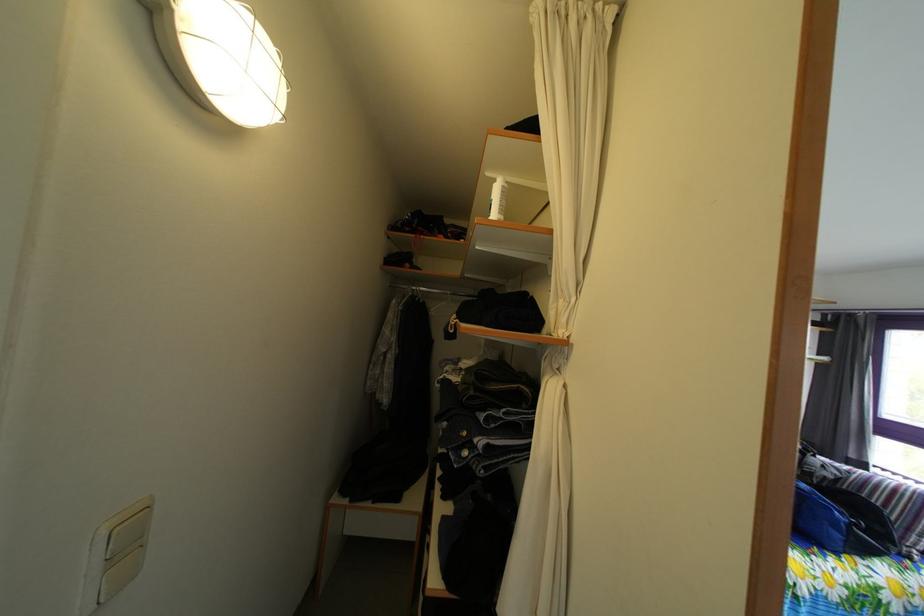
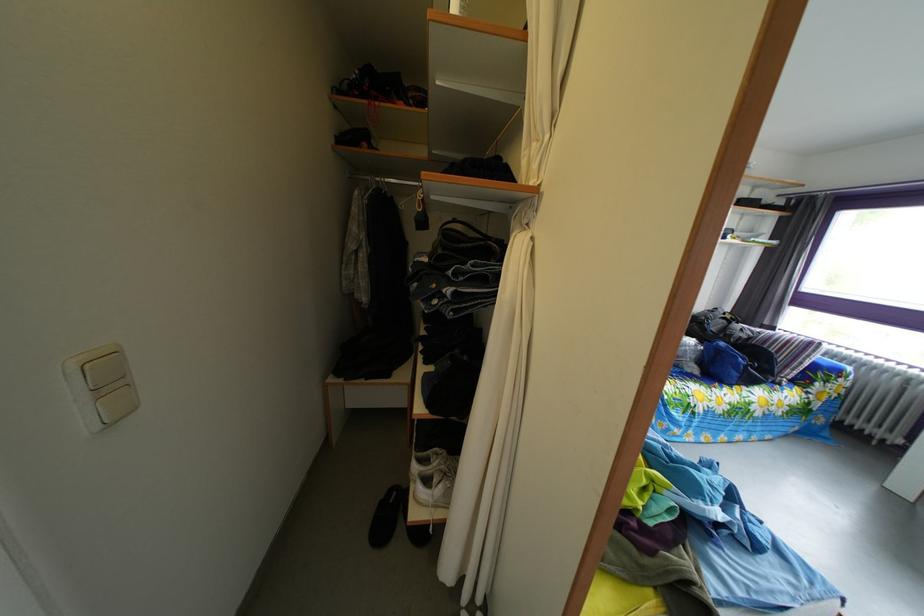
Question: In a continuous first-person perspective shot, in which direction is the camera moving?

Choices:
 (A) Left
 (B) Right
 (C) Forward
 (D) Backward

Answer: (B)